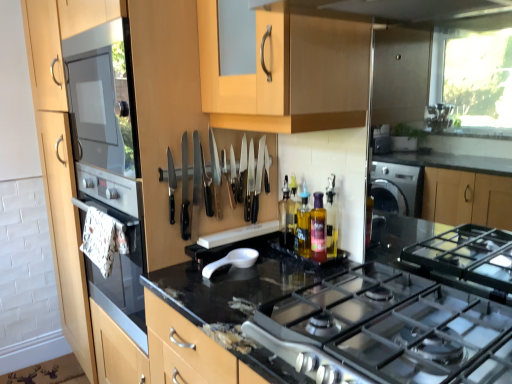
Question: Can you confirm if white matte spoon at center is bigger than translucent plastic bottle at center, which is counted as the 1th bottle, starting from the back?

Choices:
 (A) yes
 (B) no

Answer: (A)

Question: Is white matte spoon at center wider than translucent plastic bottle at center, which is counted as the 1th bottle, starting from the back?

Choices:
 (A) no
 (B) yes

Answer: (B)

Question: Can you confirm if white matte spoon at center is shorter than translucent plastic bottle at center, which is counted as the 1th bottle, starting from the back?

Choices:
 (A) no
 (B) yes

Answer: (B)

Question: Is white matte spoon at center to the right of translucent plastic bottle at center, which is counted as the 1th bottle, starting from the back, from the viewer's perspective?

Choices:
 (A) yes
 (B) no

Answer: (B)

Question: Does white matte spoon at center have a smaller size compared to translucent plastic bottle at center, which is counted as the 1th bottle, starting from the back?

Choices:
 (A) yes
 (B) no

Answer: (B)

Question: From a real-world perspective, is white matte spoon at center beneath translucent plastic bottle at center, which is the 3th bottle in front-to-back order?

Choices:
 (A) yes
 (B) no

Answer: (A)

Question: Would you say translucent purple bottle at center, acting as the 2th bottle starting from the front, contains black granite countertop at center?

Choices:
 (A) no
 (B) yes

Answer: (A)

Question: Is translucent purple bottle at center, acting as the 2th bottle starting from the front, at the left side of black granite countertop at center?

Choices:
 (A) yes
 (B) no

Answer: (B)

Question: Does translucent purple bottle at center, which is counted as the 2th bottle, starting from the back, appear on the right side of black granite countertop at center?

Choices:
 (A) no
 (B) yes

Answer: (B)

Question: Does translucent purple bottle at center, which is counted as the 2th bottle, starting from the back, have a lesser width compared to black granite countertop at center?

Choices:
 (A) yes
 (B) no

Answer: (A)

Question: Is translucent purple bottle at center, acting as the 2th bottle starting from the front, aimed at black granite countertop at center?

Choices:
 (A) no
 (B) yes

Answer: (A)

Question: Is translucent purple bottle at center, which is counted as the 2th bottle, starting from the back, closer to camera compared to black granite countertop at center?

Choices:
 (A) no
 (B) yes

Answer: (A)

Question: From the image's perspective, is white matte spoon at center under black plastic knives at center?

Choices:
 (A) no
 (B) yes

Answer: (B)